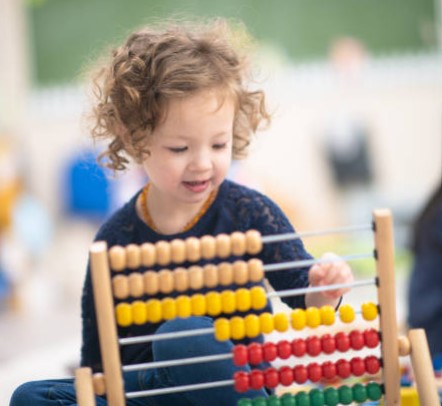
Locate an element on the screen. Image resolution: width=442 pixels, height=406 pixels. horizontal rod is located at coordinates (277, 236), (277, 266), (281, 293), (199, 332), (204, 356), (214, 384).